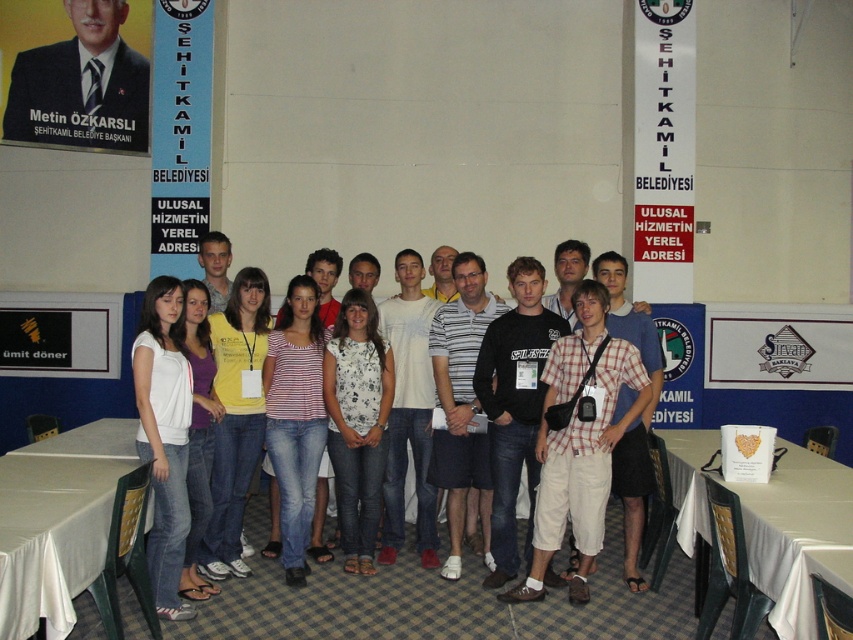
Question: Which point appears farthest from the camera in this image?

Choices:
 (A) (49, 97)
 (B) (833, 461)

Answer: (A)

Question: Among these objects, which one is nearest to the camera?

Choices:
 (A) white fabric table at lower right
 (B) matte black suit at upper left
 (C) white cotton shirt at center
 (D) white clothed table at lower left

Answer: (A)

Question: Which of the following is the farthest from the observer?

Choices:
 (A) (91, 576)
 (B) (689, 532)
 (C) (161, 524)
 (D) (561, 278)

Answer: (D)

Question: Does white fabric table at lower right appear under white clothed table at lower left?

Choices:
 (A) no
 (B) yes

Answer: (A)

Question: Can you confirm if white fabric table at lower right is positioned below white clothed table at lower left?

Choices:
 (A) yes
 (B) no

Answer: (B)

Question: Does matte black suit at upper left lie behind white cotton shirt at center?

Choices:
 (A) yes
 (B) no

Answer: (A)